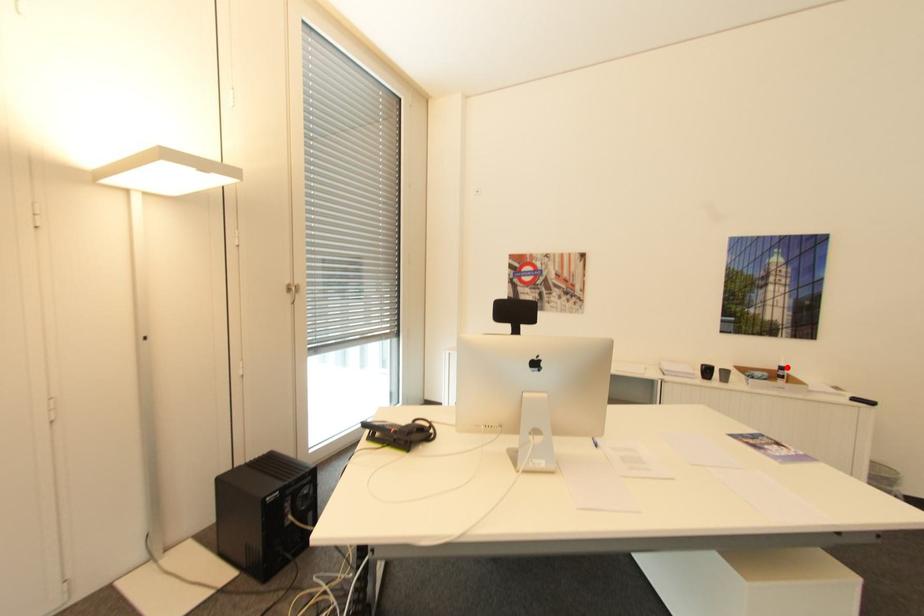
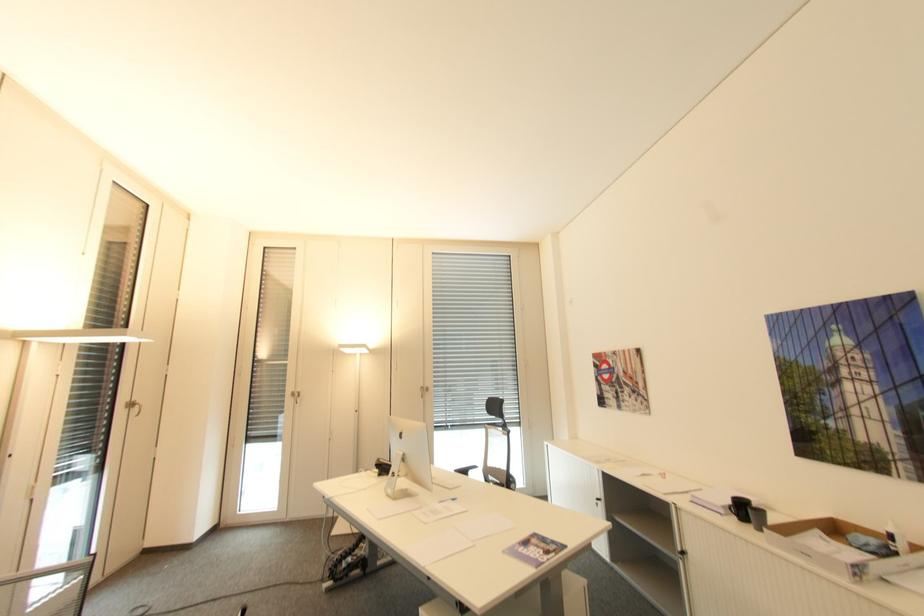
In the second image, find the point that corresponds to the highlighted location in the first image.

(895, 537)